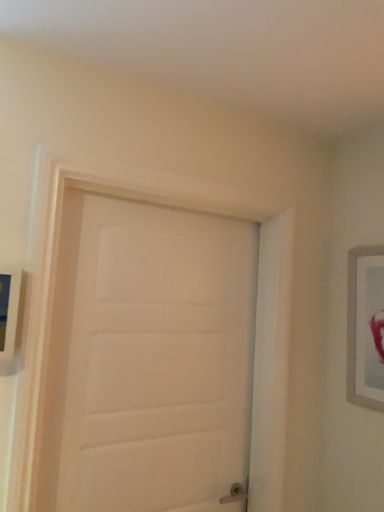
Question: Can we say silver metallic picture frame at right, which appears as the second picture frame when viewed from the left, lies outside white matte door at center?

Choices:
 (A) yes
 (B) no

Answer: (A)

Question: From a real-world perspective, is silver metallic picture frame at right, which is the 1th picture frame from back to front, beneath white matte door at center?

Choices:
 (A) no
 (B) yes

Answer: (A)

Question: Does silver metallic picture frame at right, which is the 1th picture frame from back to front, have a smaller size compared to white matte door at center?

Choices:
 (A) no
 (B) yes

Answer: (B)

Question: Does silver metallic picture frame at right, which is the 2th picture frame in front-to-back order, contain white matte door at center?

Choices:
 (A) no
 (B) yes

Answer: (A)

Question: Can you confirm if silver metallic picture frame at right, which appears as the first picture frame when viewed from the right, is shorter than white matte door at center?

Choices:
 (A) yes
 (B) no

Answer: (A)

Question: Looking at their shapes, would you say silver metallic picture frame at right, which appears as the second picture frame when viewed from the left, is wider or thinner than white matte door at center?

Choices:
 (A) wide
 (B) thin

Answer: (B)

Question: Is silver metallic picture frame at right, which appears as the second picture frame when viewed from the left, spatially inside white matte door at center, or outside of it?

Choices:
 (A) inside
 (B) outside

Answer: (B)

Question: From a real-world perspective, relative to white matte door at center, is silver metallic picture frame at right, which is the 1th picture frame from back to front, vertically above or below?

Choices:
 (A) above
 (B) below

Answer: (A)

Question: Considering the positions of silver metallic picture frame at right, which is the 2th picture frame in front-to-back order, and white matte door at center in the image, is silver metallic picture frame at right, which is the 2th picture frame in front-to-back order, taller or shorter than white matte door at center?

Choices:
 (A) short
 (B) tall

Answer: (A)

Question: From a real-world perspective, is wooden picture frame at left, arranged as the 2th picture frame when viewed from the back, physically located above or below white matte door at center?

Choices:
 (A) below
 (B) above

Answer: (B)

Question: In the image, is wooden picture frame at left, arranged as the 2th picture frame when viewed from the back, positioned in front of or behind white matte door at center?

Choices:
 (A) front
 (B) behind

Answer: (A)

Question: Is point (14, 301) positioned closer to the camera than point (87, 507)?

Choices:
 (A) farther
 (B) closer

Answer: (B)

Question: Looking at the image, does wooden picture frame at left, arranged as the 2th picture frame when viewed from the back, seem bigger or smaller compared to white matte door at center?

Choices:
 (A) big
 (B) small

Answer: (B)

Question: In terms of width, does white matte door at center look wider or thinner when compared to wooden picture frame at left, arranged as the 2th picture frame when viewed from the back?

Choices:
 (A) thin
 (B) wide

Answer: (B)

Question: Do you think white matte door at center is within wooden picture frame at left, the 2th picture frame when ordered from right to left, or outside of it?

Choices:
 (A) outside
 (B) inside

Answer: (A)